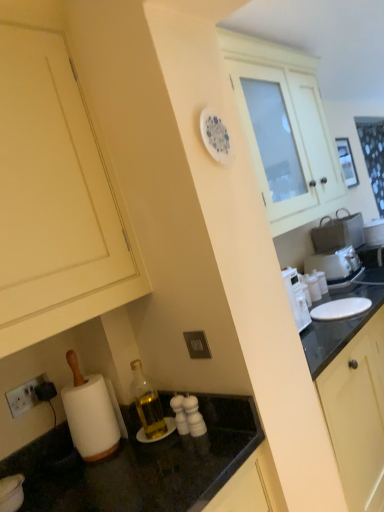
Question: From the image's perspective, does matte cream cabinet at lower left, the 2th cabinetry from the back, appear higher than white glossy cabinet at upper center, positioned as the second cabinetry in left-to-right order?

Choices:
 (A) yes
 (B) no

Answer: (B)

Question: Is the position of matte cream cabinet at lower left, which is the second cabinetry from right to left, more distant than that of white glossy cabinet at upper center, placed as the 2th cabinetry when sorted from front to back?

Choices:
 (A) no
 (B) yes

Answer: (A)

Question: Considering the relative positions of matte cream cabinet at lower left, the 2th cabinetry from the back, and white glossy cabinet at upper center, which appears as the 1th cabinetry when viewed from the right, in the image provided, is matte cream cabinet at lower left, the 2th cabinetry from the back, in front of white glossy cabinet at upper center, which appears as the 1th cabinetry when viewed from the right,?

Choices:
 (A) yes
 (B) no

Answer: (A)

Question: From a real-world perspective, is matte cream cabinet at lower left, placed as the first cabinetry when sorted from left to right, physically below white glossy cabinet at upper center, which appears as the 1th cabinetry when viewed from the back?

Choices:
 (A) yes
 (B) no

Answer: (B)

Question: Does matte cream cabinet at lower left, the first cabinetry when ordered from front to back, have a lesser width compared to white glossy cabinet at upper center, which appears as the 1th cabinetry when viewed from the right?

Choices:
 (A) no
 (B) yes

Answer: (A)

Question: Considering the positions of white plastic toaster at right and matte cream cabinet at lower left, which is the second cabinetry from right to left, in the image, is white plastic toaster at right taller or shorter than matte cream cabinet at lower left, which is the second cabinetry from right to left,?

Choices:
 (A) short
 (B) tall

Answer: (A)

Question: Visually, is white plastic toaster at right positioned to the left or to the right of matte cream cabinet at lower left, the 2th cabinetry from the back?

Choices:
 (A) left
 (B) right

Answer: (B)

Question: Is point (321, 267) positioned closer to the camera than point (16, 343)?

Choices:
 (A) closer
 (B) farther

Answer: (B)

Question: From the image's perspective, is white plastic toaster at right positioned above or below matte cream cabinet at lower left, the first cabinetry when ordered from front to back?

Choices:
 (A) above
 (B) below

Answer: (B)

Question: Is point (16, 242) positioned closer to the camera than point (334, 252)?

Choices:
 (A) farther
 (B) closer

Answer: (B)

Question: Is matte cream cabinet at lower left, the 2th cabinetry from the back, in front of or behind white plastic toaster at right in the image?

Choices:
 (A) behind
 (B) front

Answer: (B)

Question: From a real-world perspective, is matte cream cabinet at lower left, the 2th cabinetry from the back, above or below white plastic toaster at right?

Choices:
 (A) above
 (B) below

Answer: (A)

Question: Choose the correct answer: Is matte cream cabinet at lower left, the first cabinetry when ordered from front to back, inside white plastic toaster at right or outside it?

Choices:
 (A) outside
 (B) inside

Answer: (A)

Question: From a real-world perspective, relative to white plastic toaster at right, is white glossy cabinet at upper center, placed as the 2th cabinetry when sorted from front to back, vertically above or below?

Choices:
 (A) below
 (B) above

Answer: (B)

Question: From the image's perspective, relative to white plastic toaster at right, is white glossy cabinet at upper center, positioned as the second cabinetry in left-to-right order, above or below?

Choices:
 (A) above
 (B) below

Answer: (A)